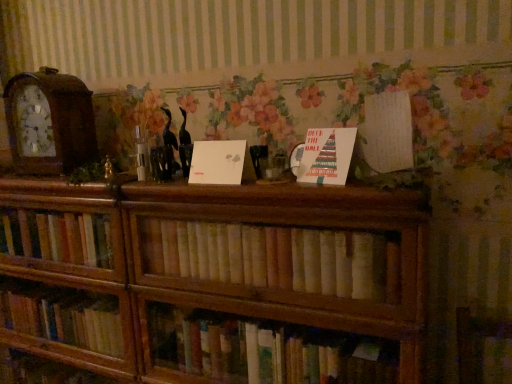
This screenshot has height=384, width=512. I want to click on wooden clock at left, so click(x=49, y=122).

This screenshot has height=384, width=512. What do you see at coordinates (211, 278) in the screenshot?
I see `wooden bookcase at center` at bounding box center [211, 278].

The width and height of the screenshot is (512, 384). Describe the element at coordinates (327, 156) in the screenshot. I see `white paper at center, positioned as the 2th paperback book in right-to-left order` at that location.

Measure the distance between light brown wooden bookshelf at center and camera.

light brown wooden bookshelf at center and camera are 38.94 inches apart from each other.

This screenshot has width=512, height=384. Identify the location of wooden clock at left. (49, 122).

Does point (390, 102) come closer to viewer compared to point (329, 150)?

No, it is not.

Can we say white paper at upper right, the 1th paperback book when ordered from right to left, lies outside white paper at center, which ranks as the 2th paperback book in left-to-right order?

white paper at upper right, the 1th paperback book when ordered from right to left, lies outside white paper at center, which ranks as the 2th paperback book in left-to-right order,'s area.

Which object is positioned more to the right, white paper at upper right, the third paperback book from the left, or white paper at center, positioned as the 2th paperback book in right-to-left order?

white paper at upper right, the third paperback book from the left, is more to the right.

Looking at their sizes, would you say white paper at upper right, the 1th paperback book when ordered from right to left, is wider or thinner than white paper at center, positioned as the 2th paperback book in right-to-left order?

Considering their sizes, white paper at upper right, the 1th paperback book when ordered from right to left, looks broader than white paper at center, positioned as the 2th paperback book in right-to-left order.

Could you tell me if wooden bookcase at center is turned towards wooden clock at left?

No, wooden bookcase at center is not aimed at wooden clock at left.

Is wooden bookcase at center outside of wooden clock at left?

Yes.

Which is closer to the camera, (x=23, y=259) or (x=62, y=144)?

Point (x=23, y=259) is farther from the camera than point (x=62, y=144).

Is white paper at center, the third paperback book when ordered from right to left, in contact with wooden bookcase at center?

No, white paper at center, the third paperback book when ordered from right to left, is not with wooden bookcase at center.

From a real-world perspective, count 1st paperback books upward from the wooden bookcase at center and point to it. Please provide its 2D coordinates.

[(217, 162)]

Is white paper at center, positioned as the first paperback book in left-to-right order, positioned with its back to wooden bookcase at center?

No.

Considering the positions of points (239, 166) and (317, 340), is point (239, 166) farther from camera compared to point (317, 340)?

No, it is in front of (317, 340).

From a real-world perspective, which object stands above the other?

From a 3D spatial view, white paper at upper right, the third paperback book from the left, is above.

Between white paper at center, positioned as the first paperback book in left-to-right order, and white paper at upper right, the 1th paperback book when ordered from right to left, which one has smaller width?

white paper at center, positioned as the first paperback book in left-to-right order, is thinner.

Based on their positions, is white paper at center, positioned as the first paperback book in left-to-right order, located to the left or right of white paper at upper right, the third paperback book from the left?

Based on their positions, white paper at center, positioned as the first paperback book in left-to-right order, is located to the left of white paper at upper right, the third paperback book from the left.

From the image's perspective, is white paper at center, positioned as the first paperback book in left-to-right order, above white paper at upper right, the 1th paperback book when ordered from right to left?

No, from the image's perspective, white paper at center, positioned as the first paperback book in left-to-right order, is not on top of white paper at upper right, the 1th paperback book when ordered from right to left.

Considering the sizes of white paper at center, the third paperback book when ordered from right to left, and white paper at center, positioned as the 2th paperback book in right-to-left order, in the image, is white paper at center, the third paperback book when ordered from right to left, taller or shorter than white paper at center, positioned as the 2th paperback book in right-to-left order,?

Clearly, white paper at center, the third paperback book when ordered from right to left, is shorter compared to white paper at center, positioned as the 2th paperback book in right-to-left order.

In the scene shown: From the image's perspective, is white paper at center, positioned as the first paperback book in left-to-right order, located above white paper at center, positioned as the 2th paperback book in right-to-left order?

Actually, white paper at center, positioned as the first paperback book in left-to-right order, appears below white paper at center, positioned as the 2th paperback book in right-to-left order, in the image.

Between point (241, 162) and point (330, 139), which one is positioned behind?

Positioned behind is point (241, 162).

Is point (321, 142) farther from viewer compared to point (394, 127)?

No.

Between white paper at center, which ranks as the 2th paperback book in left-to-right order, and white paper at upper right, the 1th paperback book when ordered from right to left, which one has larger size?

With larger size is white paper at upper right, the 1th paperback book when ordered from right to left.

From a real-world perspective, does white paper at center, which ranks as the 2th paperback book in left-to-right order, sit lower than white paper at upper right, the 1th paperback book when ordered from right to left?

Correct, in the physical world, white paper at center, which ranks as the 2th paperback book in left-to-right order, is lower than white paper at upper right, the 1th paperback book when ordered from right to left.

Looking at this image, would you say light brown wooden bookshelf at center contains white paper at center, positioned as the 2th paperback book in right-to-left order?

No.

Is light brown wooden bookshelf at center facing towards white paper at center, which ranks as the 2th paperback book in left-to-right order?

No, light brown wooden bookshelf at center is not turned towards white paper at center, which ranks as the 2th paperback book in left-to-right order.

Who is taller, light brown wooden bookshelf at center or white paper at center, positioned as the 2th paperback book in right-to-left order?

Standing taller between the two is light brown wooden bookshelf at center.

Considering the sizes of light brown wooden bookshelf at center and white paper at center, which ranks as the 2th paperback book in left-to-right order, in the image, is light brown wooden bookshelf at center bigger or smaller than white paper at center, which ranks as the 2th paperback book in left-to-right order,?

In the image, light brown wooden bookshelf at center appears to be larger than white paper at center, which ranks as the 2th paperback book in left-to-right order.

From the image's perspective, starting from the white paper at upper right, the third paperback book from the left, which paperback book is the 1st one below? Please provide its 2D coordinates.

[(327, 156)]

Locate an element on the screen. alarm clock on the left side of wooden bookcase at center is located at coordinates (49, 122).

Looking at the image, which one is located closer to white paper at center, which ranks as the 2th paperback book in left-to-right order, wooden clock at left or light brown wooden bookshelf at center?

light brown wooden bookshelf at center.

Looking at the image, which one is located further to light brown wooden bookshelf at center, wooden bookcase at center or wooden clock at left?

The object further to light brown wooden bookshelf at center is wooden clock at left.

Considering their positions, is light brown wooden bookshelf at center positioned further to wooden clock at left than wooden bookcase at center?

Among the two, light brown wooden bookshelf at center is located further to wooden clock at left.

Looking at this image, when comparing their distances from white paper at upper right, the 1th paperback book when ordered from right to left, does white paper at center, the third paperback book when ordered from right to left, or wooden bookcase at center seem further?

wooden bookcase at center.

Looking at the image, which one is located closer to white paper at upper right, the 1th paperback book when ordered from right to left, white paper at center, the third paperback book when ordered from right to left, or white paper at center, positioned as the 2th paperback book in right-to-left order?

white paper at center, positioned as the 2th paperback book in right-to-left order.

From the image, which object appears to be farther from wooden clock at left, white paper at center, positioned as the 2th paperback book in right-to-left order, or white paper at center, the third paperback book when ordered from right to left?

white paper at center, positioned as the 2th paperback book in right-to-left order.

Estimate the real-world distances between objects in this image. Which object is closer to white paper at upper right, the third paperback book from the left, wooden clock at left or white paper at center, the third paperback book when ordered from right to left?

The object closer to white paper at upper right, the third paperback book from the left, is white paper at center, the third paperback book when ordered from right to left.

Looking at the image, which one is located further to wooden bookcase at center, wooden clock at left or white paper at center, positioned as the 2th paperback book in right-to-left order?

white paper at center, positioned as the 2th paperback book in right-to-left order, is further to wooden bookcase at center.

You are a GUI agent. You are given a task and a screenshot of the screen. Output one action in this format:
    pyautogui.click(x=<x>, y=<y>)
    Task: Click on the bookcase located between wooden clock at left and white paper at center, positioned as the 2th paperback book in right-to-left order, in the left-right direction
    
    Given the screenshot: What is the action you would take?
    pyautogui.click(x=211, y=278)

I want to click on bookcase situated between wooden clock at left and white paper at upper right, the 1th paperback book when ordered from right to left, from left to right, so click(211, 278).

At what (x,y) coordinates should I click in order to perform the action: click on paperback book between white paper at center, positioned as the first paperback book in left-to-right order, and white paper at upper right, the 1th paperback book when ordered from right to left. Please return your answer as a coordinate pair (x, y). The width and height of the screenshot is (512, 384). Looking at the image, I should click on coord(327,156).

The height and width of the screenshot is (384, 512). I want to click on paperback book between white paper at center, which ranks as the 2th paperback book in left-to-right order, and light brown wooden bookshelf at center, in the vertical direction, so click(x=217, y=162).